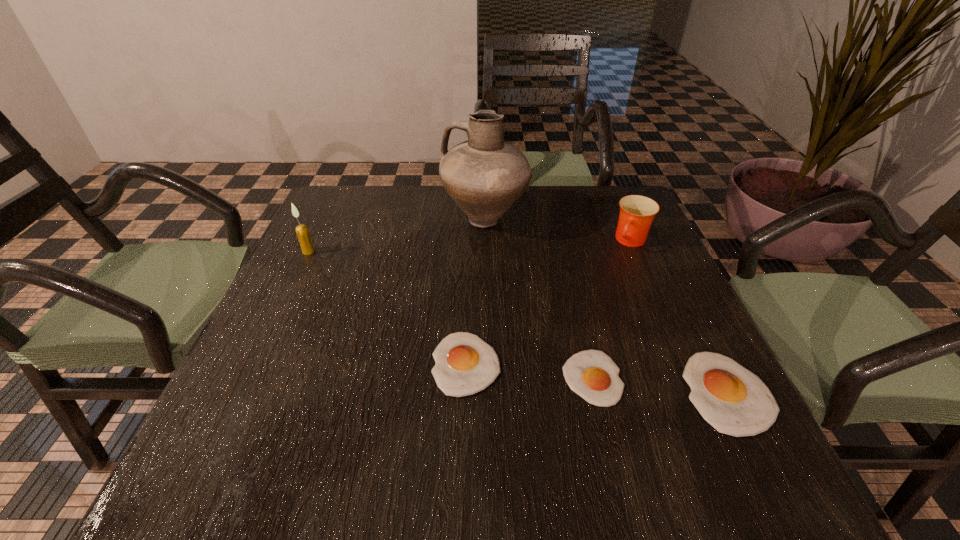
You are a GUI agent. You are given a task and a screenshot of the screen. Output one action in this format:
    pyautogui.click(x=<x>, y=<y>)
    Task: Click on the fifth tallest object
    This screenshot has height=540, width=960.
    Given the screenshot: What is the action you would take?
    pyautogui.click(x=464, y=364)

Locate an element on the screen. The width and height of the screenshot is (960, 540). the leftmost egg yolk is located at coordinates (464, 364).

Locate an element on the screen. the second egg yolk from left to right is located at coordinates (592, 374).

The image size is (960, 540). In order to click on the fourth object from left to right in this screenshot , I will do `click(592, 374)`.

Where is `the rightmost egg yolk`? Image resolution: width=960 pixels, height=540 pixels. the rightmost egg yolk is located at coordinates (732, 399).

Identify the location of the tallest object. The image size is (960, 540). (485, 176).

Locate an element on the screen. the third tallest object is located at coordinates (637, 212).

I want to click on candle, so click(302, 231).

At what (x,y) coordinates should I click in order to perform the action: click on the second tallest object. Please return your answer as a coordinate pair (x, y). The height and width of the screenshot is (540, 960). Looking at the image, I should click on (302, 231).

Where is `free region located 0.380m on the right of the fifth tallest object`? The width and height of the screenshot is (960, 540). free region located 0.380m on the right of the fifth tallest object is located at coordinates (698, 364).